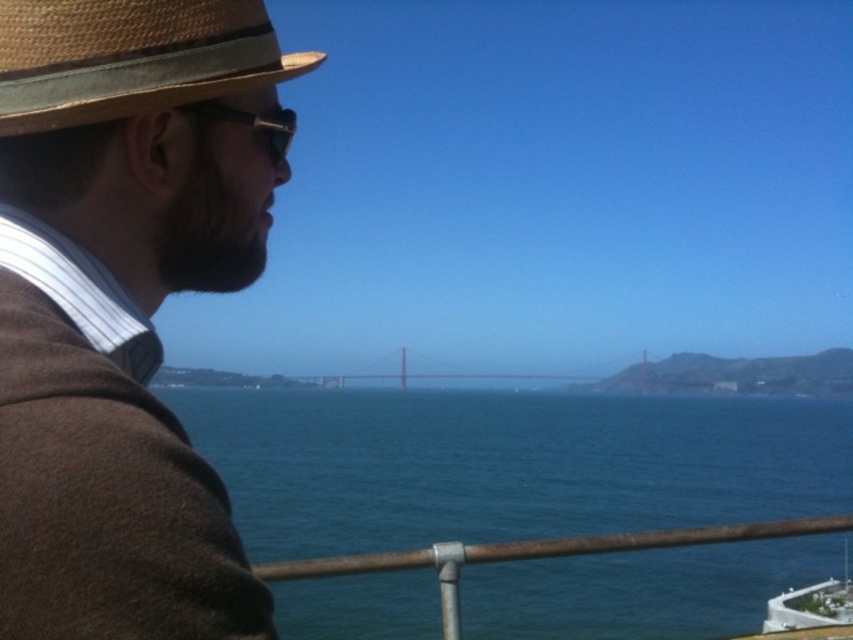
You are standing in the scene and want to take a photo of the blue water at center. Where should you point your camera?

You should point your camera towards the center of the scene at point coordinates of approximately (x=508, y=465) to capture the blue water at center.

You are a photographer trying to capture the Golden Gate Bridge in the background. You notice the blue water at center and the rusty metal rail at lower center in your shot. Which object should you move closer to in order to include more of the Golden Gate Bridge in your photo?

To include more of the Golden Gate Bridge in your photo, you should move closer to the rusty metal rail at lower center. Since the blue water at center might be wider than the rusty metal rail at lower center, moving closer to the rail would reduce its prominence in the frame, allowing more space for the bridge in the background.